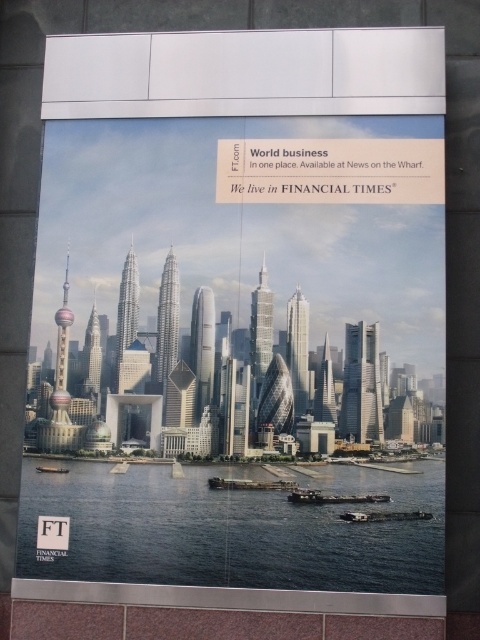
Which is behind, point (146, 557) or point (37, 467)?

The point (37, 467) is behind.

Can you confirm if dark blue water at lower center is thinner than metallic gray boat at lower left?

In fact, dark blue water at lower center might be wider than metallic gray boat at lower left.

Find the location of a particular element. dark blue water at lower center is located at coordinates (236, 529).

The height and width of the screenshot is (640, 480). What are the coordinates of `dark blue water at lower center` in the screenshot? It's located at (236, 529).

Does metallic glass skyscrapers at center appear on the right side of metallic gray boat at lower center?

No, metallic glass skyscrapers at center is not to the right of metallic gray boat at lower center.

Between metallic glass skyscrapers at center and metallic gray boat at lower center, which one has more height?

Standing taller between the two is metallic glass skyscrapers at center.

In order to click on metallic glass skyscrapers at center in this screenshot , I will do `click(236, 342)`.

Find the location of a particular element. metallic glass skyscrapers at center is located at coordinates (236, 342).

Who is lower down, dark blue water at lower center or metallic gray boat at lower center?

dark blue water at lower center is lower down.

Is dark blue water at lower center taller than metallic gray boat at lower center?

Yes, dark blue water at lower center is taller than metallic gray boat at lower center.

In order to click on dark blue water at lower center in this screenshot , I will do `click(236, 529)`.